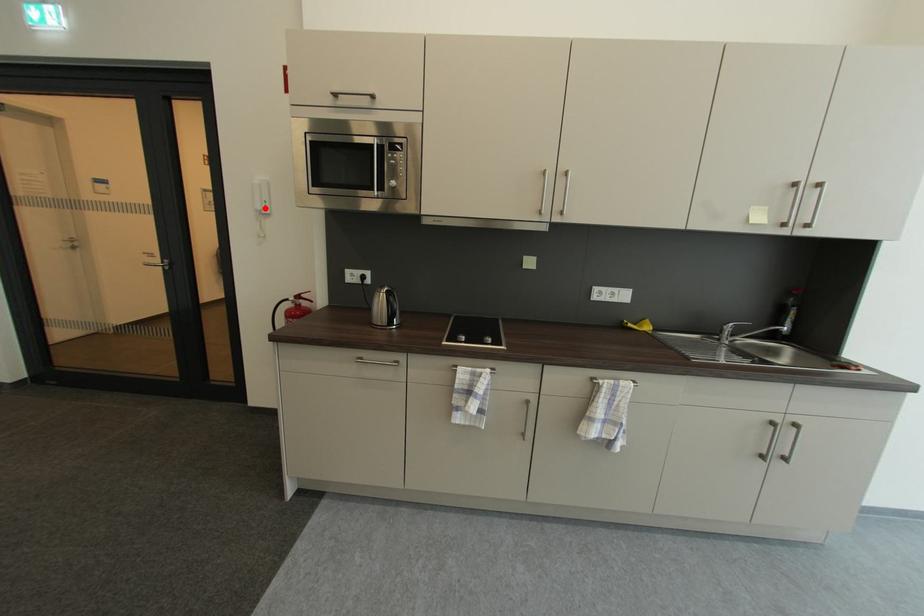
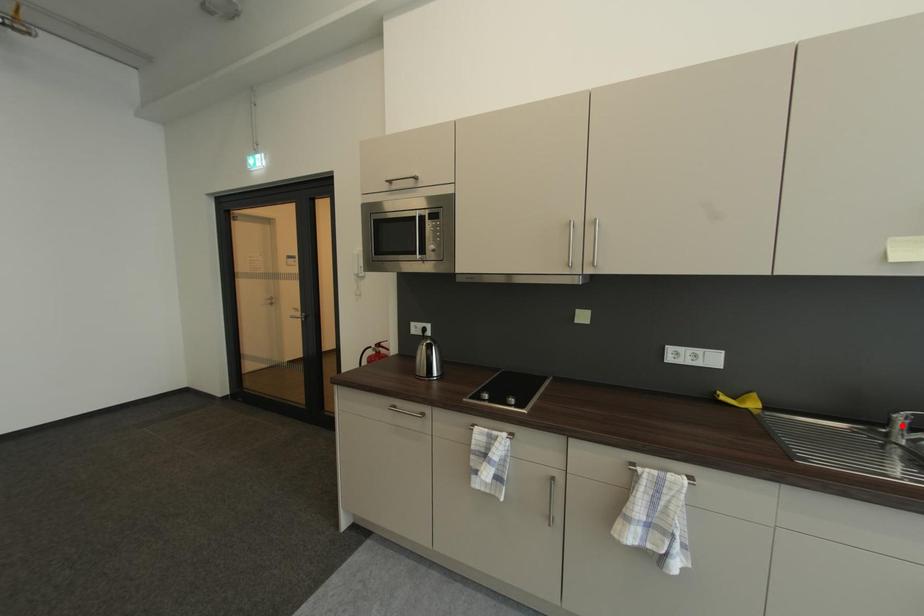
I am providing you with two images of the same scene from different viewpoints. A red point is marked on the first image and another point is marked on the second image. Is the red point in image1 aligned with the point shown in image2?

No